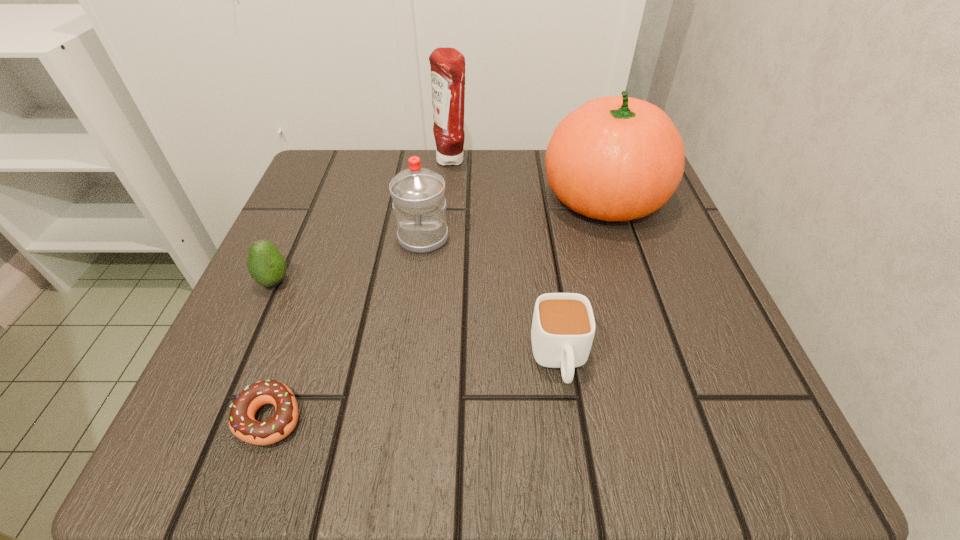
Identify the location of vacant space in between the water bottle and the pumpkin. This screenshot has height=540, width=960. (514, 218).

Where is `vacant area between the water bottle and the fourth farthest object`? vacant area between the water bottle and the fourth farthest object is located at coordinates (348, 260).

At what (x,y) coordinates should I click in order to perform the action: click on free spot between the avocado and the doughnut. Please return your answer as a coordinate pair (x, y). The image size is (960, 540). Looking at the image, I should click on (273, 349).

Where is `vacant point located between the shortest object and the condiment`? This screenshot has width=960, height=540. vacant point located between the shortest object and the condiment is located at coordinates (361, 288).

You are a GUI agent. You are given a task and a screenshot of the screen. Output one action in this format:
    pyautogui.click(x=<x>, y=<y>)
    Task: Click on the free space between the cup and the pumpkin
    Image resolution: width=960 pixels, height=540 pixels.
    Given the screenshot: What is the action you would take?
    pyautogui.click(x=582, y=279)

In order to click on vacant point located between the avocado and the condiment in this screenshot , I will do `click(363, 221)`.

Locate an element on the screen. This screenshot has height=540, width=960. object that is the fourth closest one to the cup is located at coordinates (267, 266).

Where is `object that ranks as the closest to the condiment`? object that ranks as the closest to the condiment is located at coordinates (616, 158).